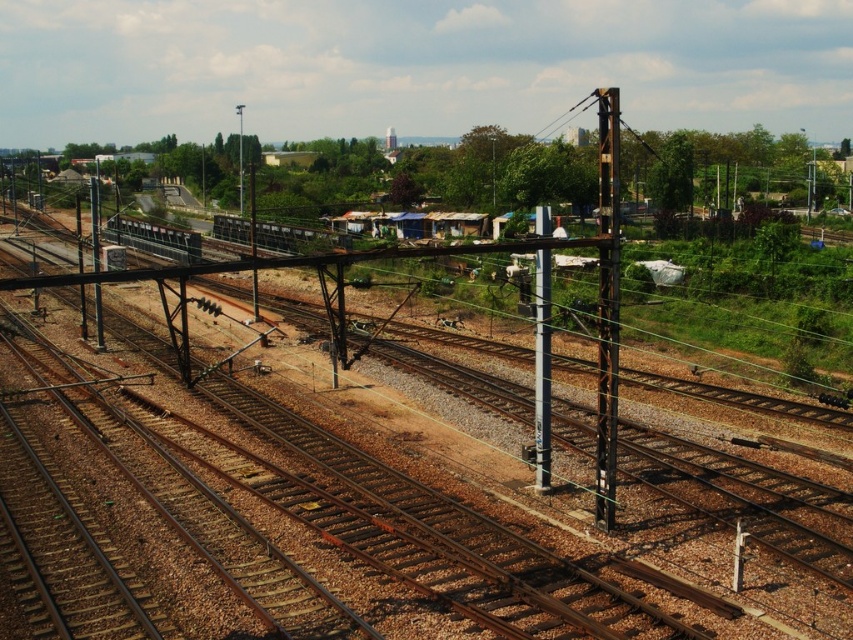
Question: Which of these objects is positioned farthest from the shiny silver train at left?

Choices:
 (A) rusty metal track at center
 (B) black metallic pole at center-right
 (C) metallic pole at left
 (D) metallic pole at upper center

Answer: (B)

Question: Does shiny silver train at left come in front of metallic wire at upper right?

Choices:
 (A) yes
 (B) no

Answer: (B)

Question: Which of the following is the closest to the observer?

Choices:
 (A) rusty metal track at center
 (B) metallic gray train at center
 (C) metallic pole at center

Answer: (C)

Question: Which of the following is the farthest from the observer?

Choices:
 (A) (183, 230)
 (B) (253, 208)

Answer: (A)

Question: Is black metallic pole at center-right thinner than shiny silver train at left?

Choices:
 (A) no
 (B) yes

Answer: (B)

Question: Is metallic gray train at center to the right of shiny silver train at left from the viewer's perspective?

Choices:
 (A) yes
 (B) no

Answer: (A)